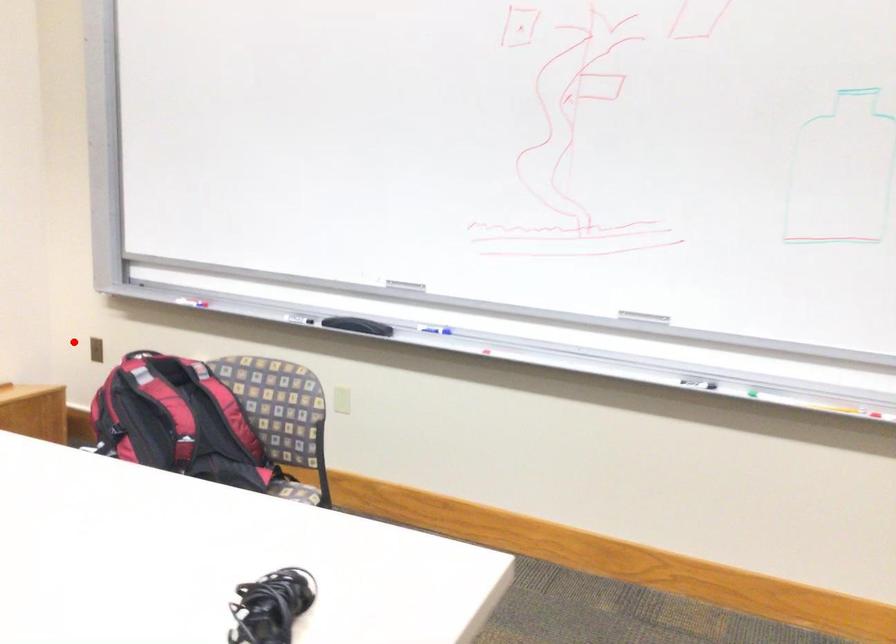
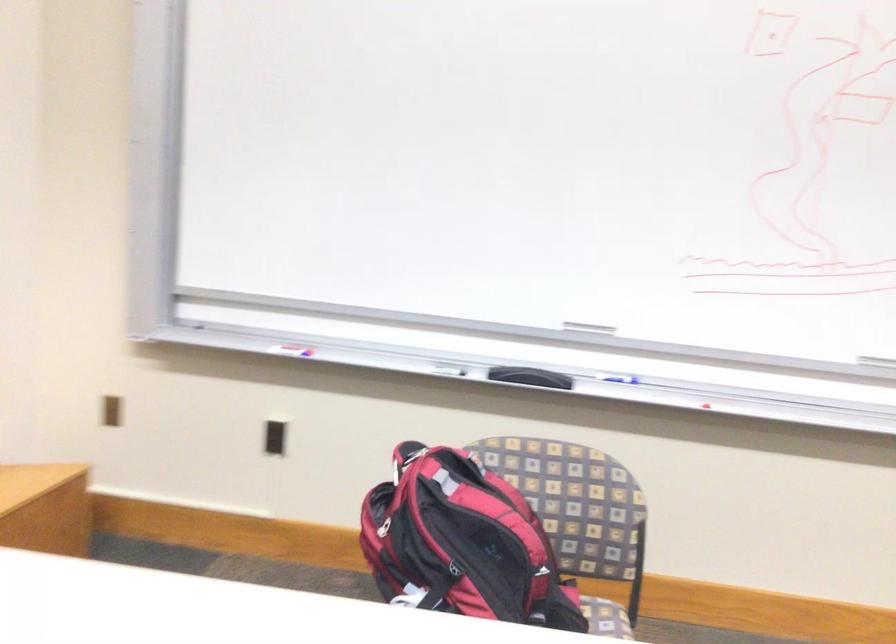
The point at the highlighted location is marked in the first image. Where is the corresponding point in the second image?

(112, 410)